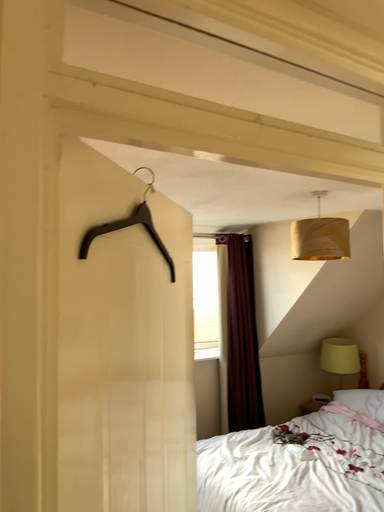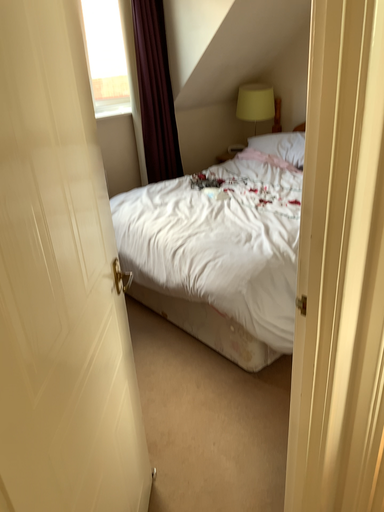
Question: Which way did the camera rotate in the video?

Choices:
 (A) rotated left
 (B) rotated right

Answer: (B)